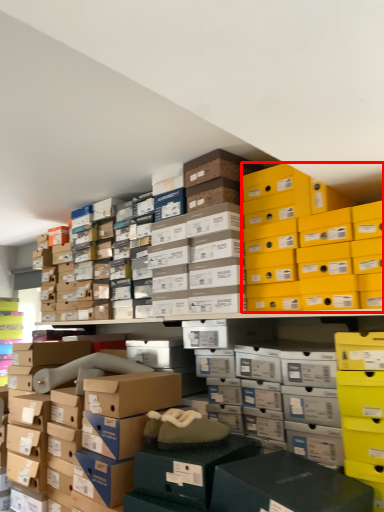
Question: From the image, what is the correct spatial relationship of storage box (annotated by the red box) in relation to storage box?

Choices:
 (A) right
 (B) left

Answer: (A)